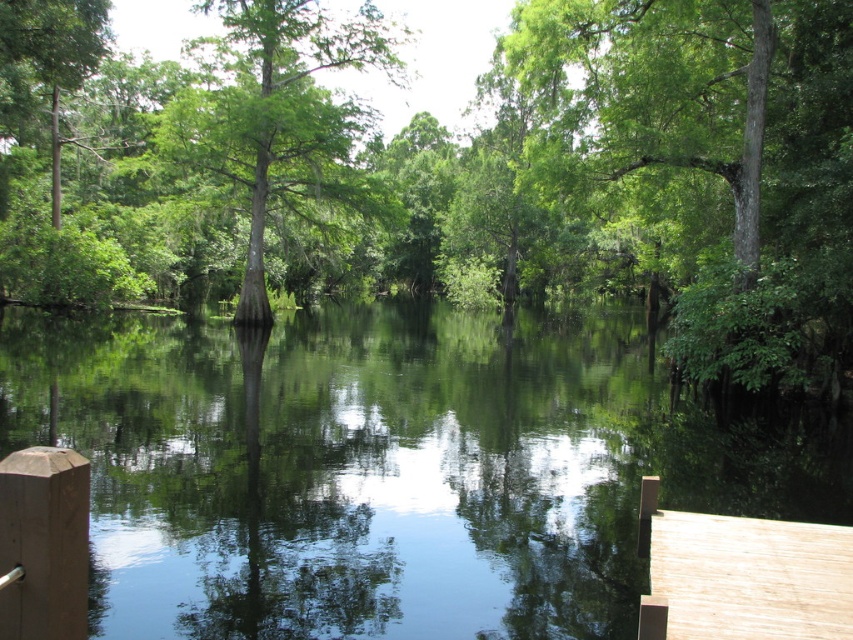
Is green leafy tree at center below green matte tree at center?

Yes.

Based on the photo, can you confirm if green leafy tree at center is positioned to the right of green matte tree at center?

Yes, green leafy tree at center is to the right of green matte tree at center.

Where is `green leafy tree at center`? green leafy tree at center is located at coordinates (460, 170).

Who is higher up, green leafy tree at center or green reflective water at center?

A: green leafy tree at center is higher up.

Can you confirm if green leafy tree at center is positioned to the right of green reflective water at center?

Incorrect, green leafy tree at center is not on the right side of green reflective water at center.

Where is `green leafy tree at center`? green leafy tree at center is located at coordinates (460, 170).

Who is more distant from viewer, (631, 525) or (253, 109)?

Positioned behind is point (253, 109).

Between green reflective water at center and green matte tree at center, which one is positioned higher?

green matte tree at center is above.

Image resolution: width=853 pixels, height=640 pixels. Find the location of `green reflective water at center`. green reflective water at center is located at coordinates (390, 467).